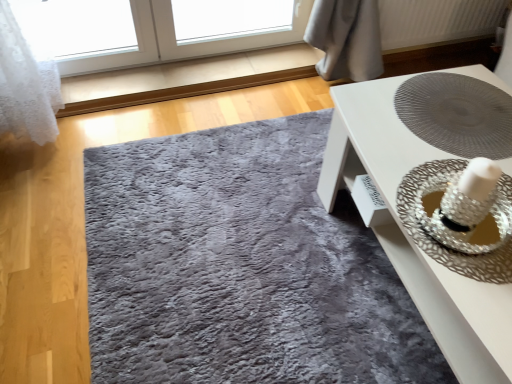
Question: Is white textured radiator at upper right positioned with its back to shaggy gray rug at center?

Choices:
 (A) no
 (B) yes

Answer: (A)

Question: From a real-world perspective, does white textured radiator at upper right stand above shaggy gray rug at center?

Choices:
 (A) yes
 (B) no

Answer: (A)

Question: From the image's perspective, does white textured radiator at upper right appear higher than shaggy gray rug at center?

Choices:
 (A) yes
 (B) no

Answer: (A)

Question: Is white textured radiator at upper right bigger than shaggy gray rug at center?

Choices:
 (A) no
 (B) yes

Answer: (A)

Question: Is white textured radiator at upper right positioned in front of shaggy gray rug at center?

Choices:
 (A) no
 (B) yes

Answer: (A)

Question: Would you say white textured radiator at upper right is to the left or to the right of shaggy gray rug at center in the picture?

Choices:
 (A) left
 (B) right

Answer: (B)

Question: From a real-world perspective, is white textured radiator at upper right above or below shaggy gray rug at center?

Choices:
 (A) below
 (B) above

Answer: (B)

Question: Is white textured radiator at upper right wider or thinner than shaggy gray rug at center?

Choices:
 (A) thin
 (B) wide

Answer: (A)

Question: From the image's perspective, is white textured radiator at upper right located above or below shaggy gray rug at center?

Choices:
 (A) below
 (B) above

Answer: (B)

Question: From a real-world perspective, is silver metallic straw hat at right positioned above or below white glossy table at center?

Choices:
 (A) below
 (B) above

Answer: (B)

Question: Is silver metallic straw hat at right in front of or behind white glossy table at center in the image?

Choices:
 (A) front
 (B) behind

Answer: (B)

Question: Considering the positions of silver metallic straw hat at right and white glossy table at center in the image, is silver metallic straw hat at right bigger or smaller than white glossy table at center?

Choices:
 (A) small
 (B) big

Answer: (A)

Question: From the image's perspective, is silver metallic straw hat at right positioned above or below white glossy table at center?

Choices:
 (A) above
 (B) below

Answer: (A)

Question: From the image's perspective, relative to white textured radiator at upper right, is white glossy table at center above or below?

Choices:
 (A) above
 (B) below

Answer: (B)

Question: Does point (424, 145) appear closer or farther from the camera than point (441, 26)?

Choices:
 (A) farther
 (B) closer

Answer: (B)